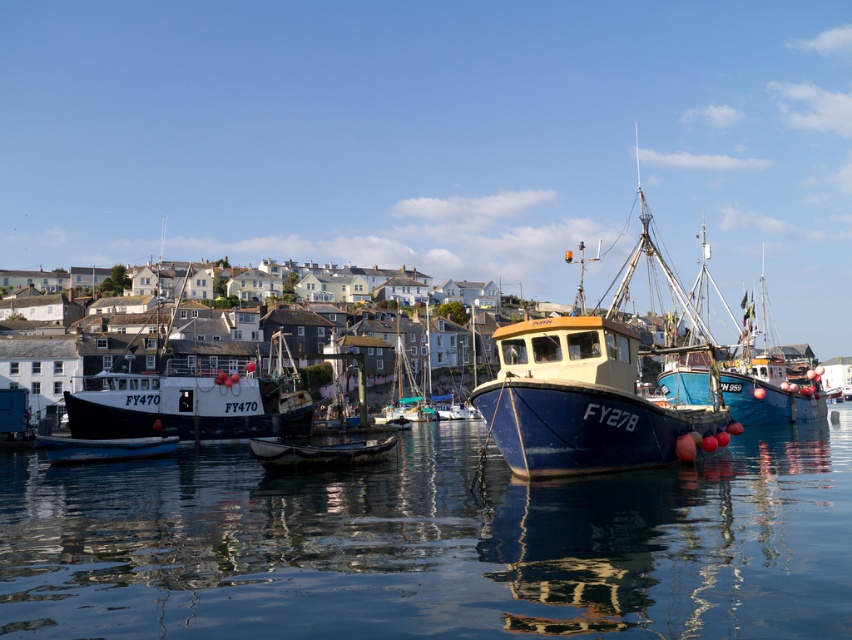
You are a sailor trying to navigate a small dinghy through the harbor. You see the glossy blue water at center and the black matte fishing boat at center. Which one has a larger area to pass through?

The black matte fishing boat at center has a larger area compared to the glossy blue water at center, so the dinghy can pass through the area around the black matte fishing boat at center more easily.

You are standing at the edge of the harbor looking out. There are two points marked in the image, one at point [727,538] and the other at point [171,364]. Which point is closer to you?

Point [727,538] is closer to the viewer than point [171,364].